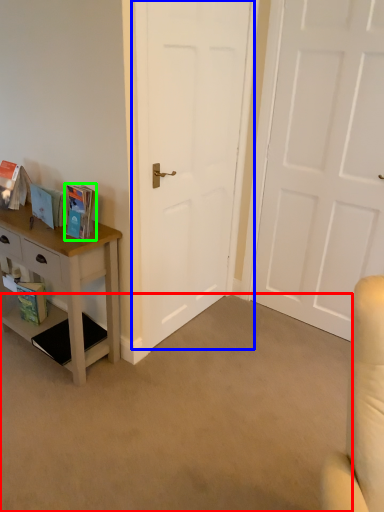
Question: Which object is the closest to the plain (highlighted by a red box)? Choose among these: door (highlighted by a blue box) or book (highlighted by a green box).

Choices:
 (A) door
 (B) book

Answer: (A)